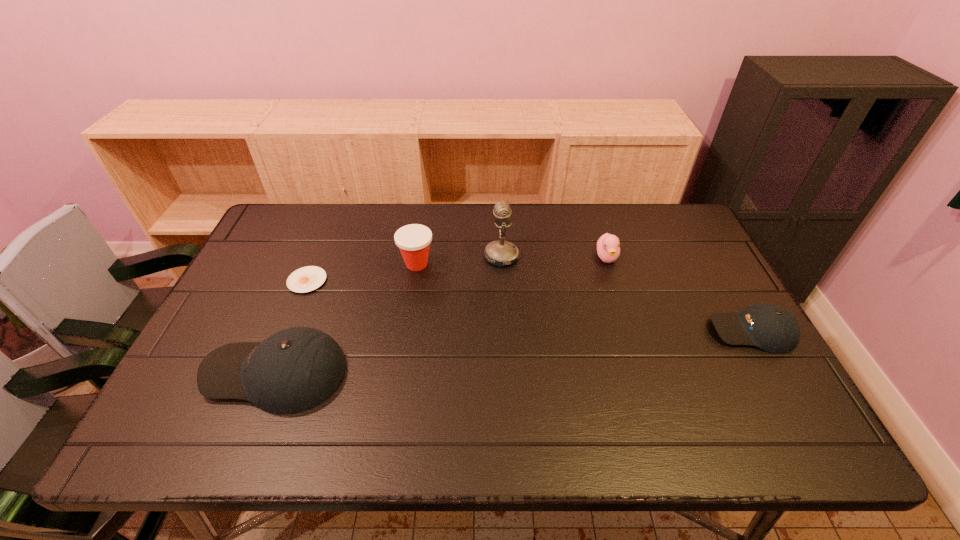
Where is `empty space that is in between the taller baseball cap and the egg yolk`? The width and height of the screenshot is (960, 540). empty space that is in between the taller baseball cap and the egg yolk is located at coordinates (292, 327).

Where is `free spot between the third object from left to right and the tallest object`? The width and height of the screenshot is (960, 540). free spot between the third object from left to right and the tallest object is located at coordinates (459, 260).

The height and width of the screenshot is (540, 960). I want to click on object identified as the fifth closest to the fourth object from right to left, so pyautogui.click(x=770, y=327).

Locate an element on the screen. The width and height of the screenshot is (960, 540). object that ranks as the fourth closest to the taller baseball cap is located at coordinates (608, 249).